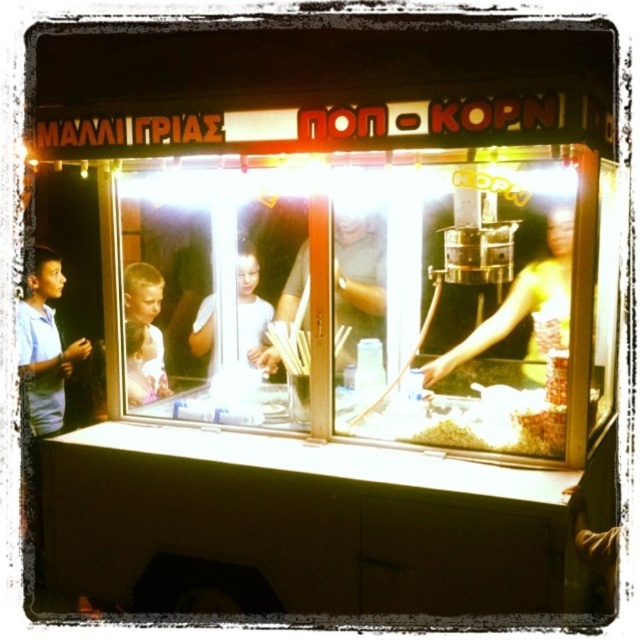
Question: Is white matte paper at center closer to camera compared to white glossy shirt at center?

Choices:
 (A) no
 (B) yes

Answer: (B)

Question: Which of the following is the closest to the observer?

Choices:
 (A) (381, 269)
 (B) (266, 321)

Answer: (A)

Question: Can you confirm if white matte paper at center is positioned above white glossy shirt at center?

Choices:
 (A) yes
 (B) no

Answer: (A)

Question: Which object appears closest to the camera in this image?

Choices:
 (A) white matte paper at center
 (B) white glossy shirt at center

Answer: (A)

Question: Where is white matte paper at center located in relation to white glossy shirt at center in the image?

Choices:
 (A) above
 (B) below

Answer: (A)